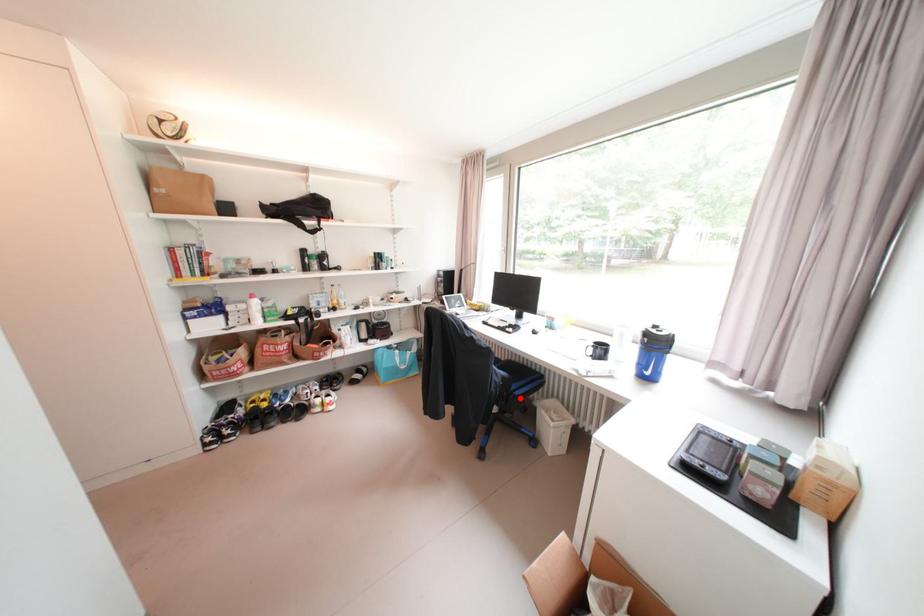
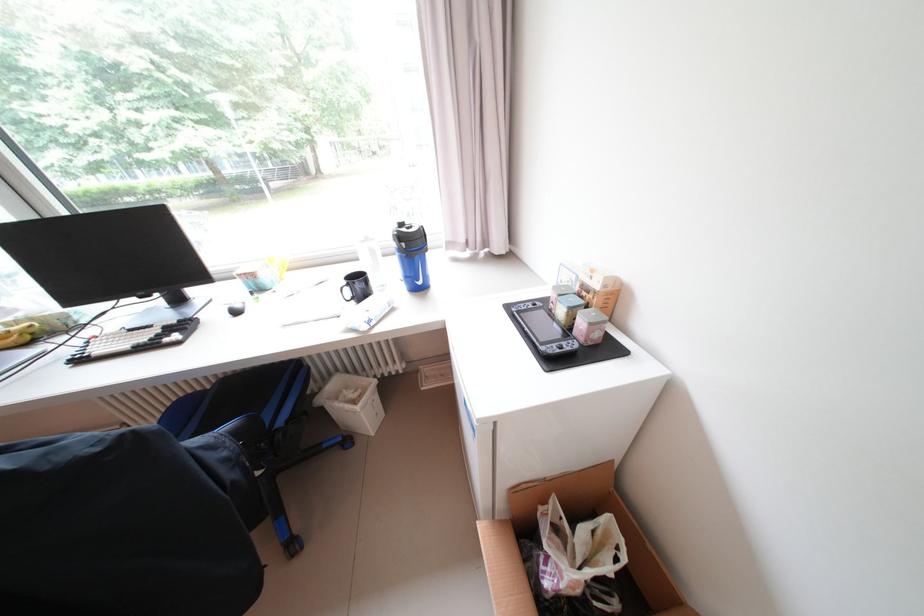
Locate, in the second image, the point that corresponds to the highlighted location in the first image.

(286, 438)